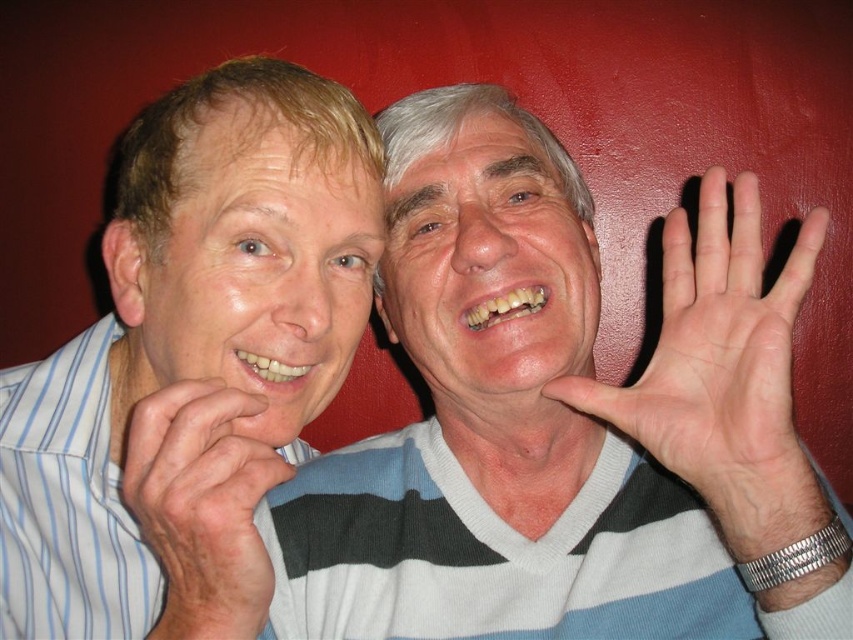
Question: Based on their relative distances, which object is nearer to the dry skin hand at lower left?

Choices:
 (A) matte white face at left
 (B) pale skin palm at center
 (C) white striped sweater at center

Answer: (A)

Question: Which is nearer to the dry skin hand at lower left?

Choices:
 (A) white striped shirt at left
 (B) matte white face at left

Answer: (B)

Question: Can you confirm if pale skin palm at center is positioned to the right of smooth skin face at center?

Choices:
 (A) yes
 (B) no

Answer: (A)

Question: Is white striped sweater at center bigger than matte white face at left?

Choices:
 (A) yes
 (B) no

Answer: (A)

Question: Which object appears farthest from the camera in this image?

Choices:
 (A) matte white face at left
 (B) white striped shirt at left
 (C) white striped sweater at center
 (D) smooth skin face at center

Answer: (D)

Question: Does white striped sweater at center have a lesser width compared to smooth skin face at center?

Choices:
 (A) yes
 (B) no

Answer: (B)